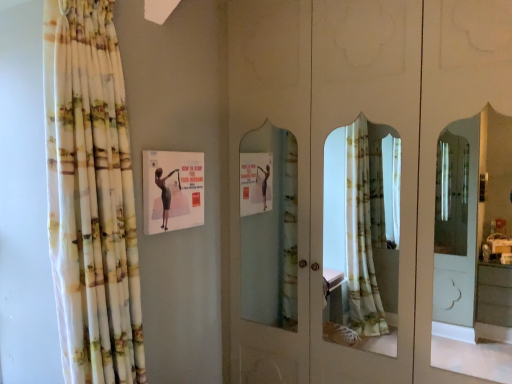
Question: Would you say matte paper poster at upper center is inside or outside floral fabric curtain at left?

Choices:
 (A) outside
 (B) inside

Answer: (A)

Question: Visually, is matte paper poster at upper center positioned to the left or to the right of floral fabric curtain at left?

Choices:
 (A) left
 (B) right

Answer: (B)

Question: Is matte paper poster at upper center wider or thinner than floral fabric curtain at left?

Choices:
 (A) wide
 (B) thin

Answer: (B)

Question: From a real-world perspective, is floral fabric curtain at left above or below matte paper poster at upper center?

Choices:
 (A) above
 (B) below

Answer: (B)

Question: Considering their positions, is floral fabric curtain at left located in front of or behind matte paper poster at upper center?

Choices:
 (A) behind
 (B) front

Answer: (B)

Question: Is floral fabric curtain at left bigger or smaller than matte paper poster at upper center?

Choices:
 (A) small
 (B) big

Answer: (B)

Question: From the image's perspective, relative to matte paper poster at upper center, is floral fabric curtain at left above or below?

Choices:
 (A) above
 (B) below

Answer: (B)